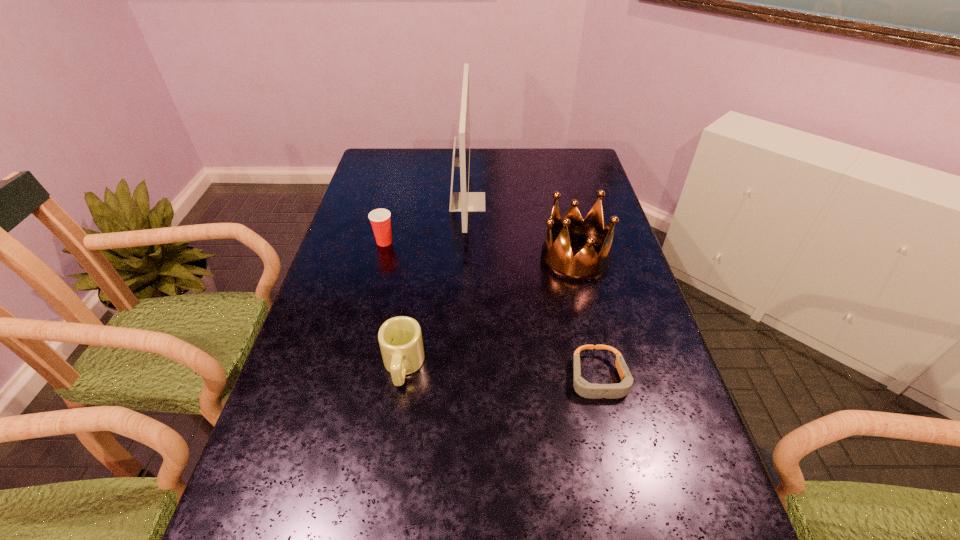
Image resolution: width=960 pixels, height=540 pixels. I want to click on free spot that satisfies the following two spatial constraints: 1. on the front-facing side of the tallest object; 2. on the left side of the crown, so click(x=466, y=259).

This screenshot has height=540, width=960. What are the coordinates of `vacant region that satisfies the following two spatial constraints: 1. on the front-facing side of the third object from right to left; 2. on the left side of the crown` in the screenshot? It's located at (466, 259).

Locate an element on the screen. vacant area in the image that satisfies the following two spatial constraints: 1. on the front-facing side of the monitor; 2. on the left side of the fourth shortest object is located at coordinates (466, 259).

Image resolution: width=960 pixels, height=540 pixels. I want to click on vacant space that satisfies the following two spatial constraints: 1. on the front side of the leftmost object; 2. on the left side of the second tallest object, so pos(380,259).